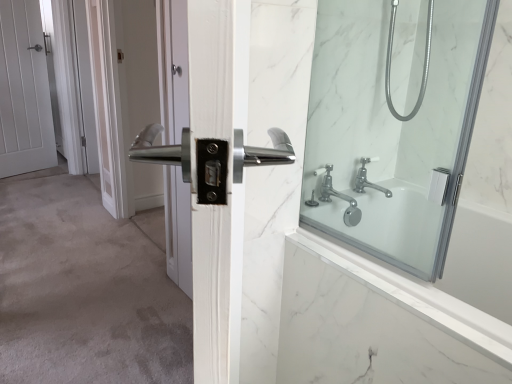
Question: Considering the relative sizes of polished silver handle at center, the second screen door in the back-to-front sequence, and chrome metallic faucet at upper right in the image provided, is polished silver handle at center, the second screen door in the back-to-front sequence, bigger than chrome metallic faucet at upper right?

Choices:
 (A) yes
 (B) no

Answer: (A)

Question: Is polished silver handle at center, arranged as the 1th screen door when viewed from the front, at the right side of chrome metallic faucet at upper right?

Choices:
 (A) yes
 (B) no

Answer: (B)

Question: Considering the relative positions of polished silver handle at center, arranged as the 1th screen door when viewed from the front, and chrome metallic faucet at upper right in the image provided, is polished silver handle at center, arranged as the 1th screen door when viewed from the front, behind chrome metallic faucet at upper right?

Choices:
 (A) yes
 (B) no

Answer: (A)

Question: From the image's perspective, is polished silver handle at center, the second screen door in the back-to-front sequence, located beneath chrome metallic faucet at upper right?

Choices:
 (A) no
 (B) yes

Answer: (A)

Question: Considering the relative sizes of polished silver handle at center, the second screen door in the back-to-front sequence, and chrome metallic faucet at upper right in the image provided, is polished silver handle at center, the second screen door in the back-to-front sequence, shorter than chrome metallic faucet at upper right?

Choices:
 (A) no
 (B) yes

Answer: (A)

Question: Does point (141, 23) appear closer or farther from the camera than point (327, 195)?

Choices:
 (A) farther
 (B) closer

Answer: (A)

Question: Is polished silver handle at center, the second screen door in the back-to-front sequence, situated inside chrome metallic faucet at upper right or outside?

Choices:
 (A) inside
 (B) outside

Answer: (B)

Question: Relative to chrome metallic faucet at upper right, is polished silver handle at center, marked as the 2th screen door in a left-to-right arrangement, in front or behind?

Choices:
 (A) front
 (B) behind

Answer: (B)

Question: Is polished silver handle at center, the 1th screen door positioned from the right, taller or shorter than chrome metallic faucet at upper right?

Choices:
 (A) tall
 (B) short

Answer: (A)

Question: In the image, is white marble bath at right on the left side or the right side of polished silver handle at center, marked as the 2th screen door in a left-to-right arrangement?

Choices:
 (A) left
 (B) right

Answer: (B)

Question: Looking at the image, does white marble bath at right seem bigger or smaller compared to polished silver handle at center, the second screen door in the back-to-front sequence?

Choices:
 (A) small
 (B) big

Answer: (B)

Question: Considering the positions of white marble bath at right and polished silver handle at center, arranged as the 1th screen door when viewed from the front, in the image, is white marble bath at right taller or shorter than polished silver handle at center, arranged as the 1th screen door when viewed from the front,?

Choices:
 (A) short
 (B) tall

Answer: (A)

Question: Considering their positions, is white marble bath at right located in front of or behind polished silver handle at center, the 1th screen door positioned from the right?

Choices:
 (A) behind
 (B) front

Answer: (B)

Question: Considering the positions of white matte door at left and polished silver handle at center, the 1th screen door positioned from the right, in the image, is white matte door at left bigger or smaller than polished silver handle at center, the 1th screen door positioned from the right,?

Choices:
 (A) big
 (B) small

Answer: (B)

Question: From the image's perspective, relative to polished silver handle at center, marked as the 2th screen door in a left-to-right arrangement, is white matte door at left above or below?

Choices:
 (A) below
 (B) above

Answer: (B)